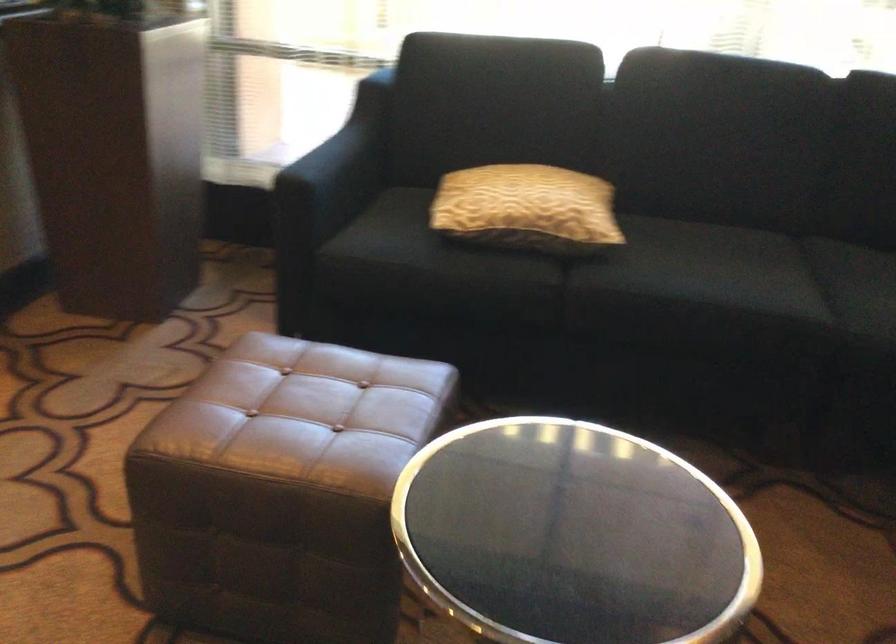
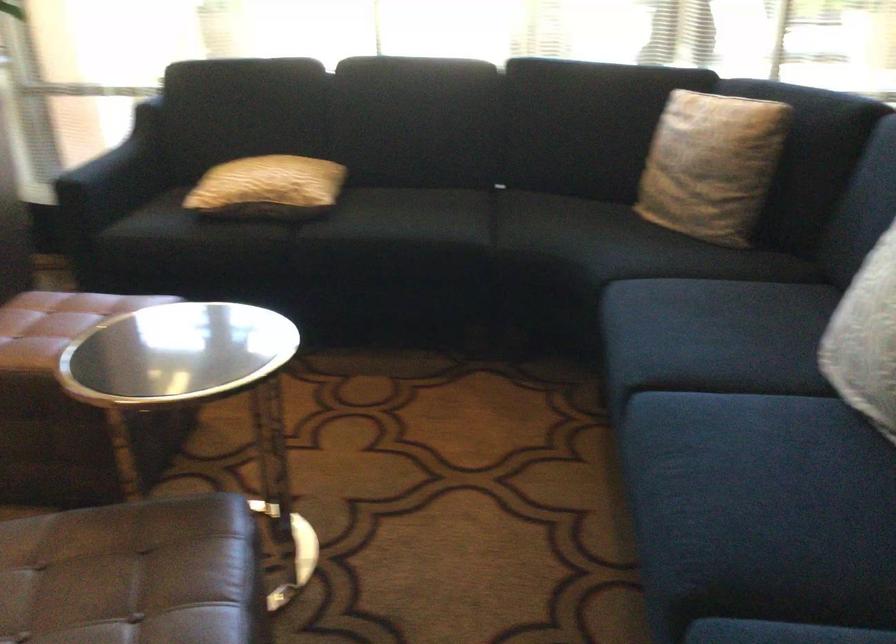
Which direction would the cameraman need to move to produce the second image?

The movement direction of the cameraman is right, backward.